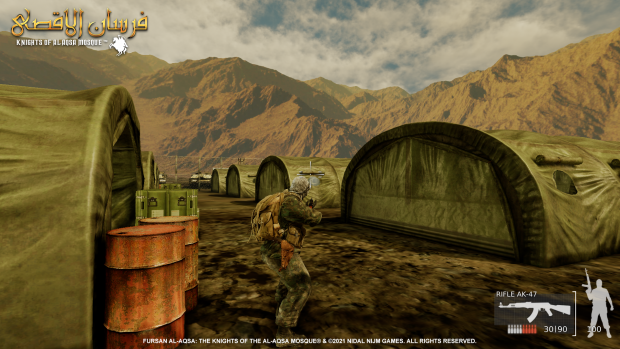
Image resolution: width=620 pixels, height=349 pixels. Identify the location of canteen. [294, 236].